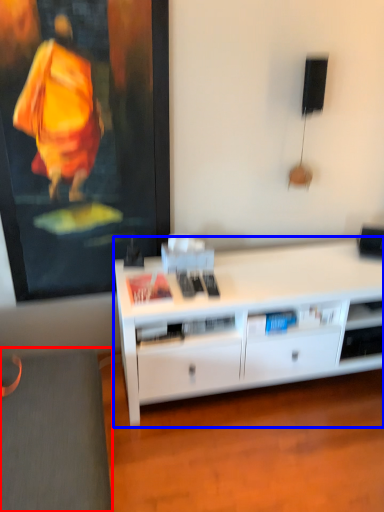
Question: Which object appears farthest to the camera in this image, gray (highlighted by a red box) or desk (highlighted by a blue box)?

Choices:
 (A) gray
 (B) desk

Answer: (B)